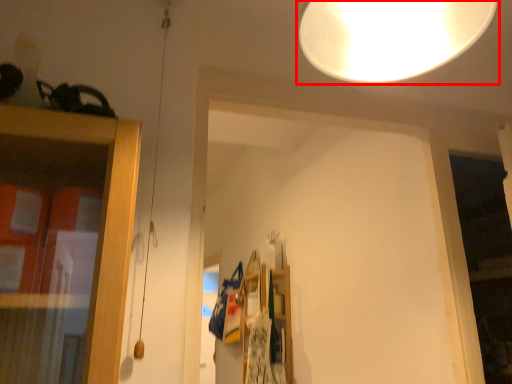
Question: From the image's perspective, what is the correct spatial relationship of lamp (annotated by the red box) in relation to shelf?

Choices:
 (A) above
 (B) below

Answer: (A)